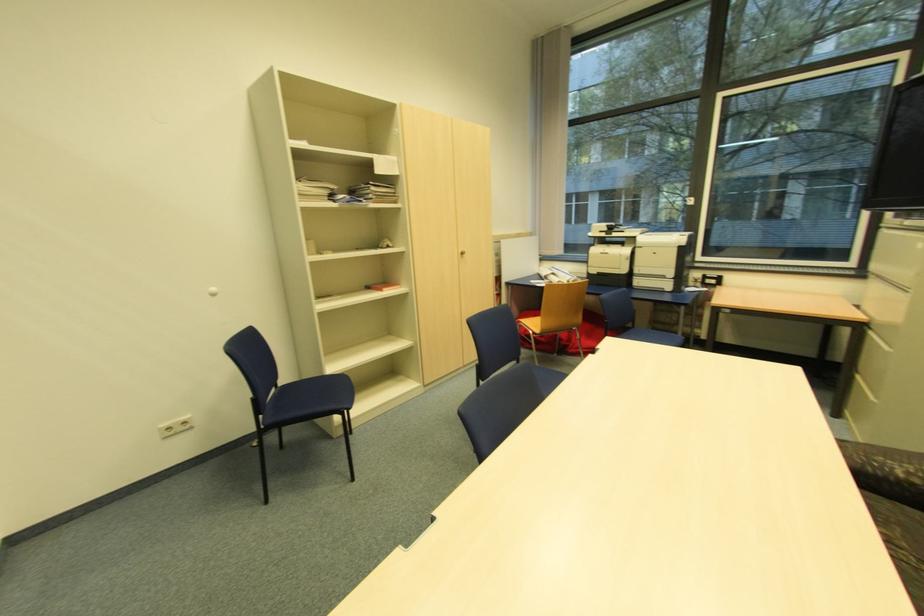
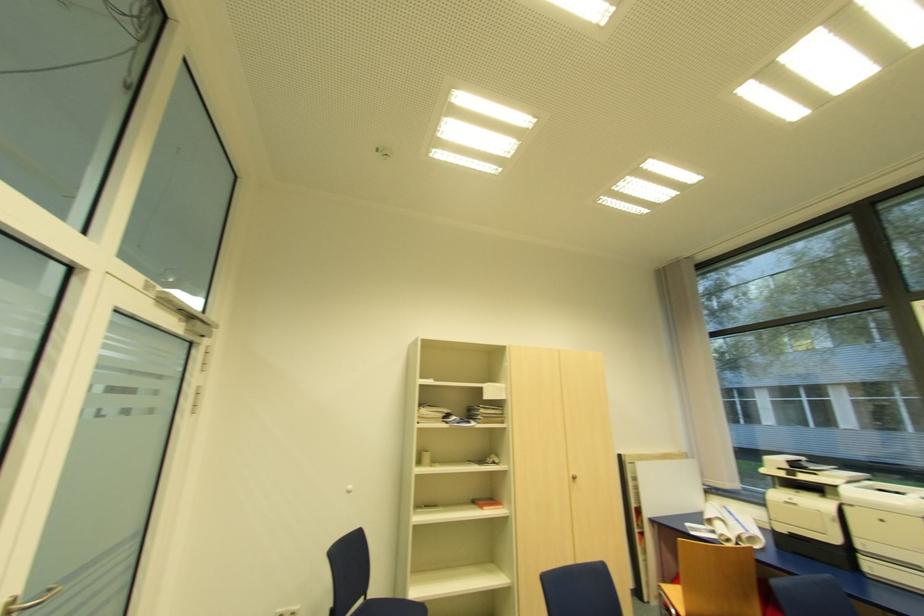
Locate, in the second image, the point that corresponds to (x=466, y=254) in the first image.

(576, 477)